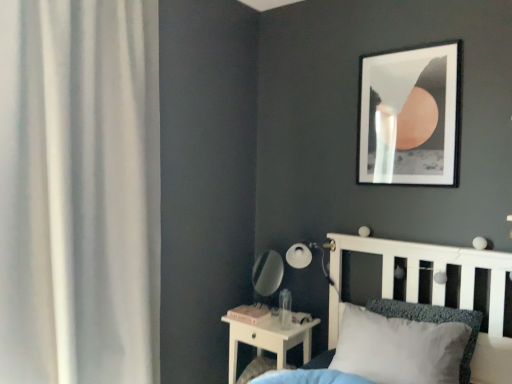
Question: Should I look upward or downward to see white wood nightstand at lower center?

Choices:
 (A) up
 (B) down

Answer: (B)

Question: Does white wood nightstand at lower center have a greater width compared to white sheer curtain at left?

Choices:
 (A) no
 (B) yes

Answer: (B)

Question: Considering the relative positions of white wood nightstand at lower center and white sheer curtain at left in the image provided, is white wood nightstand at lower center to the left of white sheer curtain at left from the viewer's perspective?

Choices:
 (A) no
 (B) yes

Answer: (A)

Question: From a real-world perspective, is white wood nightstand at lower center over white sheer curtain at left?

Choices:
 (A) no
 (B) yes

Answer: (A)

Question: Is white wood nightstand at lower center shorter than white sheer curtain at left?

Choices:
 (A) no
 (B) yes

Answer: (B)

Question: Is white wood nightstand at lower center outside of white sheer curtain at left?

Choices:
 (A) no
 (B) yes

Answer: (B)

Question: Can you confirm if white wood nightstand at lower center is smaller than white sheer curtain at left?

Choices:
 (A) no
 (B) yes

Answer: (B)

Question: Can you see shiny silver mirror at center touching matte black picture frame at upper right?

Choices:
 (A) no
 (B) yes

Answer: (A)

Question: From the image's perspective, is shiny silver mirror at center above matte black picture frame at upper right?

Choices:
 (A) no
 (B) yes

Answer: (A)

Question: Does shiny silver mirror at center turn towards matte black picture frame at upper right?

Choices:
 (A) yes
 (B) no

Answer: (B)

Question: Is the depth of shiny silver mirror at center less than that of matte black picture frame at upper right?

Choices:
 (A) yes
 (B) no

Answer: (B)

Question: Considering the relative positions of shiny silver mirror at center and matte black picture frame at upper right in the image provided, is shiny silver mirror at center behind matte black picture frame at upper right?

Choices:
 (A) no
 (B) yes

Answer: (B)

Question: From a real-world perspective, is shiny silver mirror at center positioned over matte black picture frame at upper right based on gravity?

Choices:
 (A) yes
 (B) no

Answer: (B)

Question: From the image's perspective, is white sheer curtain at left above white matte bed at center?

Choices:
 (A) no
 (B) yes

Answer: (B)